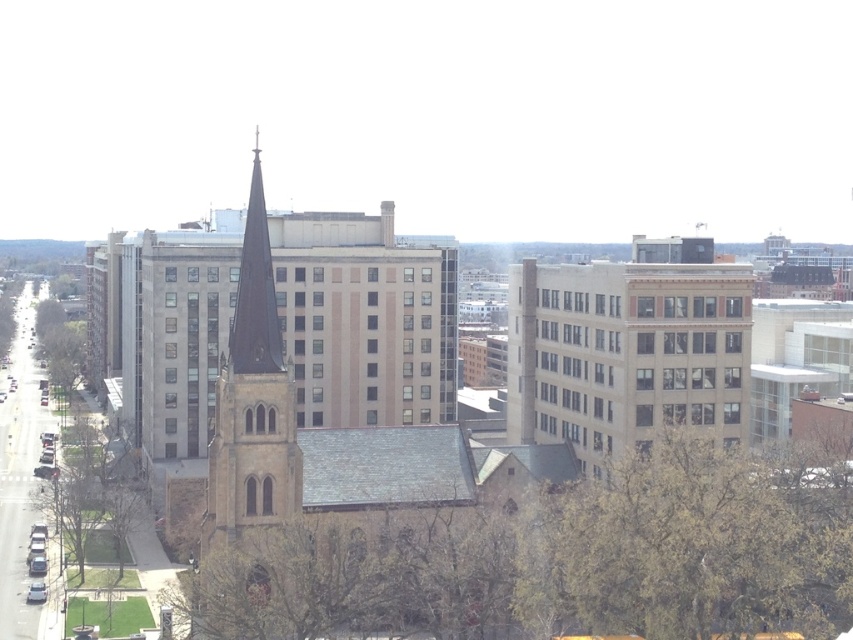
You are standing in the city square and want to take a photo of the brown stone church at center. However, there is a green leafy tree at left in the way. Can you see the church clearly through the tree?

The brown stone church at center is closer to the viewer than the green leafy tree at left, so the tree is behind the church and won

You are a city planner assessing the urban layout. Considering the brown stone church at center and the green leafy tree at lower left, which object occupies more space in the scene?

The brown stone church at center has a larger size compared to the green leafy tree at lower left, so it occupies more space in the scene.

You are standing at point (532, 545) in the urban landscape. What can you see immediately to your left?

To your left, you can see the green leafy tree at lower left.